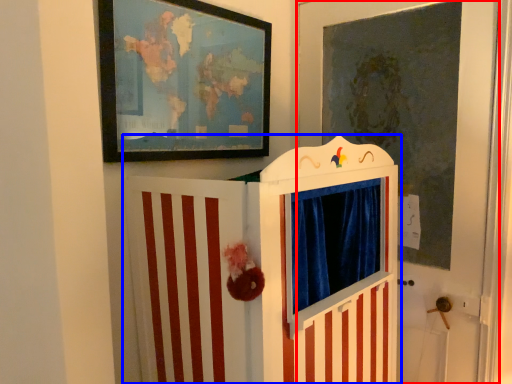
Question: Among these objects, which one is farthest to the camera, door (highlighted by a red box) or furniture (highlighted by a blue box)?

Choices:
 (A) door
 (B) furniture

Answer: (A)